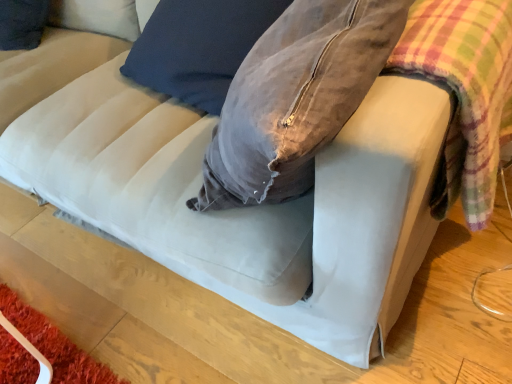
Question: Relative to velvet gray bean bag chair at center, is plaid fabric at right in front or behind?

Choices:
 (A) behind
 (B) front

Answer: (B)

Question: Looking at their shapes, would you say plaid fabric at right is wider or thinner than velvet gray bean bag chair at center?

Choices:
 (A) wide
 (B) thin

Answer: (B)

Question: Is plaid fabric at right to the left or to the right of velvet gray bean bag chair at center in the image?

Choices:
 (A) left
 (B) right

Answer: (B)

Question: Relative to plaid fabric at right, is velvet gray bean bag chair at center in front or behind?

Choices:
 (A) front
 (B) behind

Answer: (B)

Question: Is velvet gray bean bag chair at center inside or outside of plaid fabric at right?

Choices:
 (A) outside
 (B) inside

Answer: (A)

Question: Considering the positions of velvet gray bean bag chair at center and plaid fabric at right in the image, is velvet gray bean bag chair at center bigger or smaller than plaid fabric at right?

Choices:
 (A) small
 (B) big

Answer: (B)

Question: From the image's perspective, is velvet gray bean bag chair at center positioned above or below plaid fabric at right?

Choices:
 (A) above
 (B) below

Answer: (A)